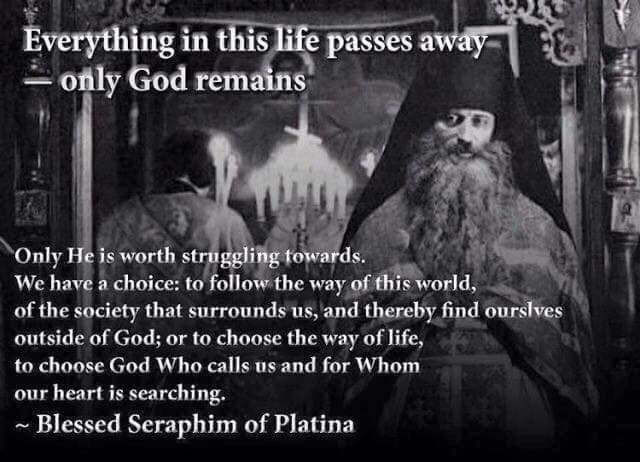
The image size is (640, 462). I want to click on candles, so click(300, 181), click(220, 174).